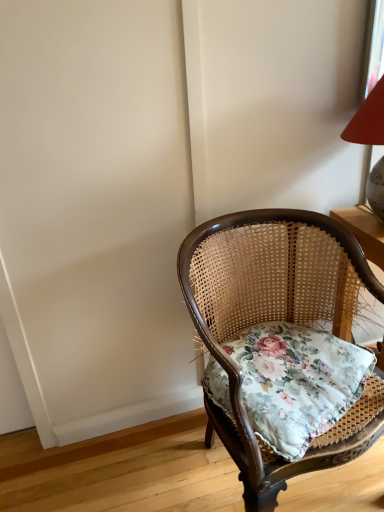
This screenshot has height=512, width=384. In order to click on vacant space that is to the left of woven wood chair at center in this screenshot , I will do `click(127, 465)`.